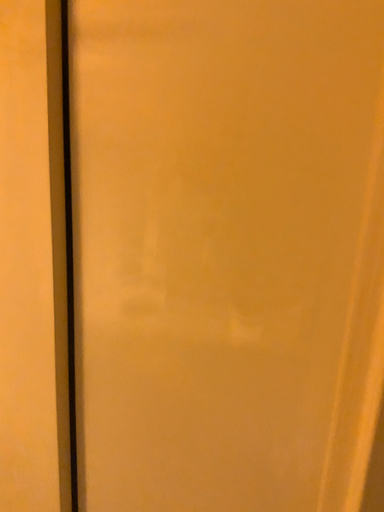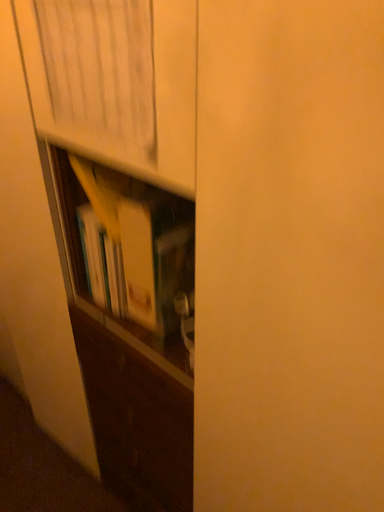
Question: How did the camera likely rotate when shooting the video?

Choices:
 (A) rotated left
 (B) rotated right

Answer: (A)